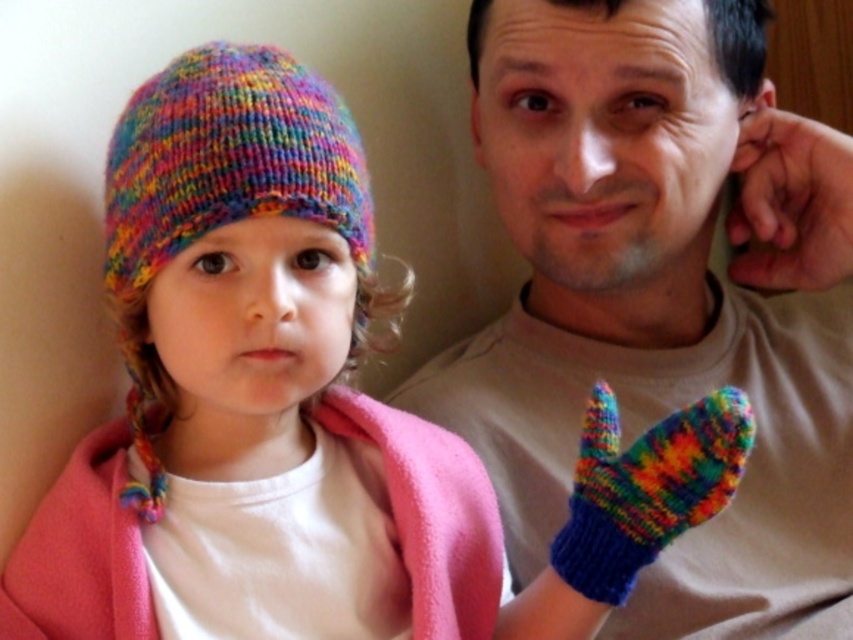
You are a photographer standing 30 inches away from the camera. You want to take a photo of the knitted beige shirt at center. Is the shirt within your reach to adjust its position?

The knitted beige shirt at center is 30.15 inches away from the camera, so it is slightly out of your reach since you are standing 30 inches away from the camera.